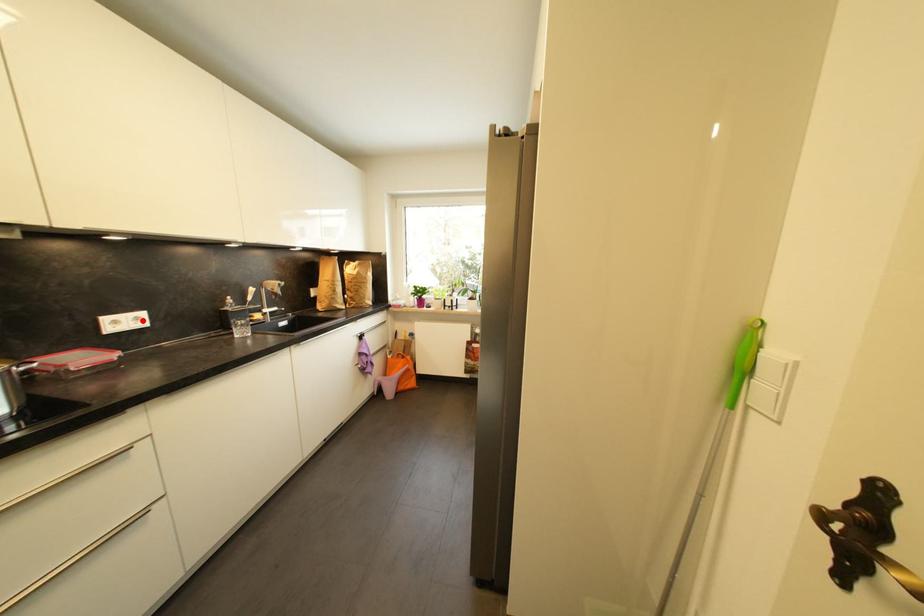
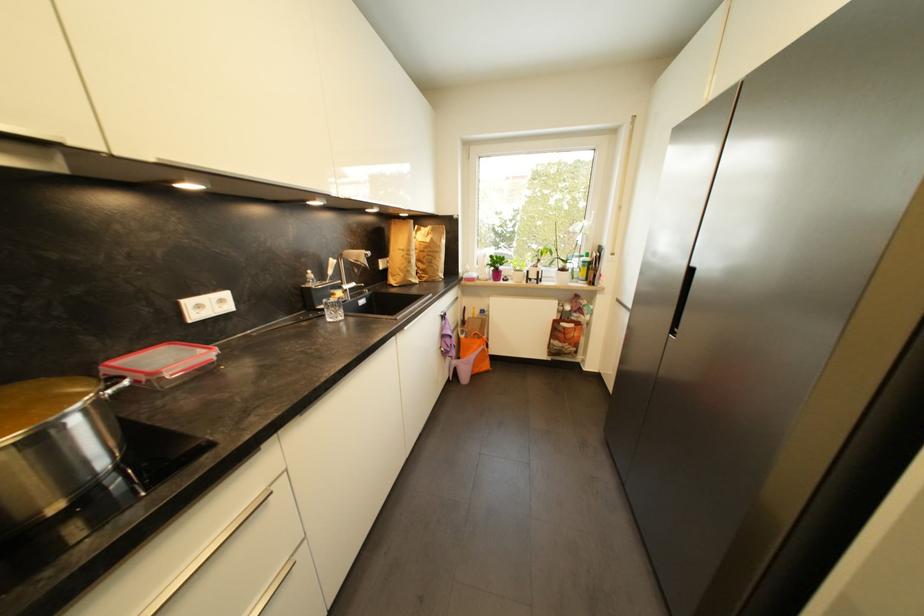
The point at the highlighted location is marked in the first image. Where is the corresponding point in the second image?

(226, 302)